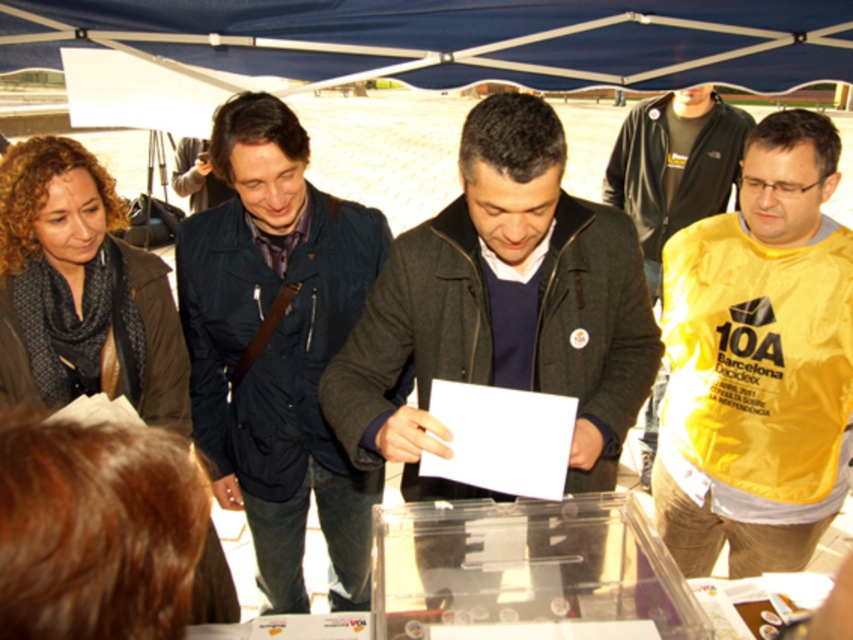
Question: Which object appears closest to the camera in this image?

Choices:
 (A) brown scarf at upper left
 (B) dark blue jacket at center
 (C) yellow fabric shirt at right
 (D) dark gray jacket at center

Answer: (D)

Question: Observing the image, what is the correct spatial positioning of blue fabric canopy at upper center in reference to yellow fabric shirt at right?

Choices:
 (A) above
 (B) below

Answer: (A)

Question: Estimate the real-world distances between objects in this image. Which object is farther from the yellow fabric vest at center?

Choices:
 (A) dark blue jacket at center
 (B) yellow fabric shirt at right
 (C) dark gray jacket at center
 (D) brown scarf at upper left

Answer: (B)

Question: Which of the following is the closest to the observer?

Choices:
 (A) (648, 220)
 (B) (825, 4)

Answer: (B)

Question: Is dark gray jacket at center closer to the viewer compared to yellow fabric vest at center?

Choices:
 (A) yes
 (B) no

Answer: (A)

Question: Observing the image, what is the correct spatial positioning of yellow fabric vest at center in reference to brown scarf at upper left?

Choices:
 (A) left
 (B) right

Answer: (B)